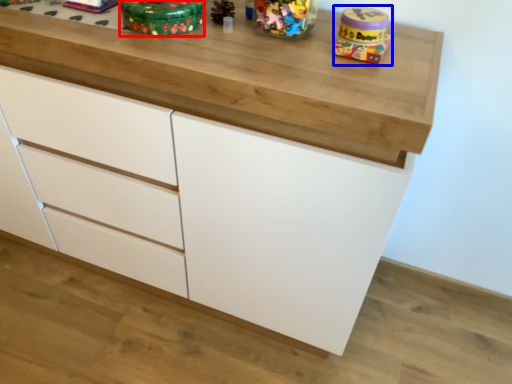
Question: Which of the following is the farthest to the observer, toy (highlighted by a red box) or toy (highlighted by a blue box)?

Choices:
 (A) toy
 (B) toy

Answer: (B)